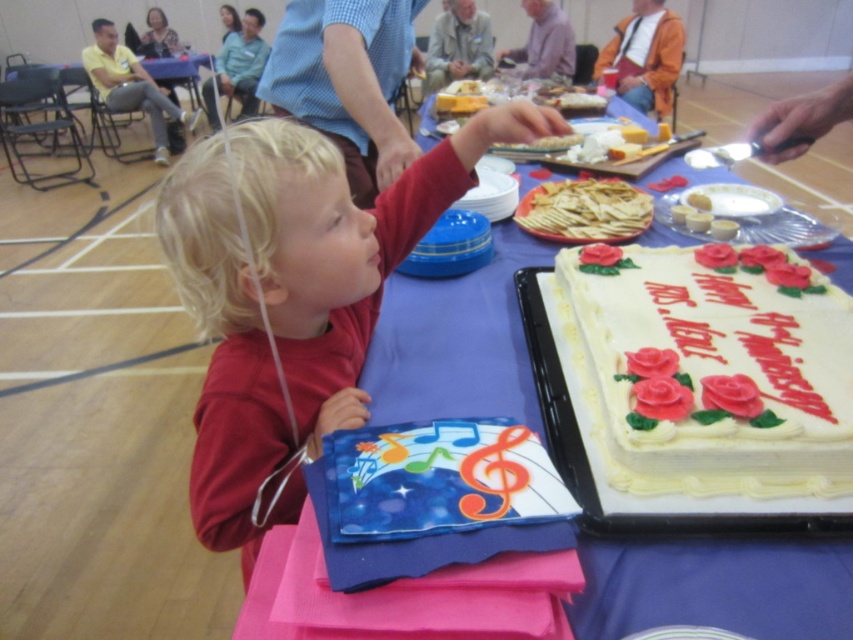
You are a guest at the celebration and want to grab a snack. The light brown crispy crackers at center and the yellow cake at right are both on the table. Which one is closer to you if you are standing directly in front of the table?

The light brown crispy crackers at center is located below the yellow cake at right, so if you are standing directly in front of the table, the light brown crispy crackers at center would be closer to you since it is positioned lower on the table.

You are at a birthday party and see the light brown crispy crackers at center and the yellow cake at right. Which item is closer to the left side of the table?

The light brown crispy crackers at center are closer to the left side of the table than the yellow cake at right.